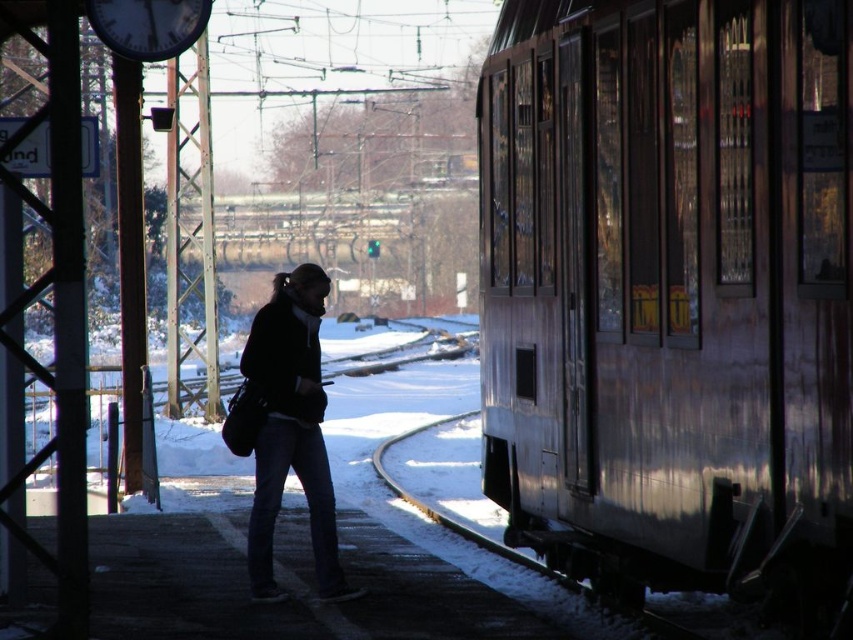
You are standing on a snowy train platform and see the wooden paneling train at right and the dark blue jeans at center. Which object is positioned to the right of the other?

The wooden paneling train at right is to the right of dark blue jeans at center.

You are standing on the train station platform and want to board the wooden paneling train at right. Where exactly should you go to board it?

The wooden paneling train at right is located at point 0.456 on the x axis and 0.787 on the y axis, so you should go to that coordinate to board it.